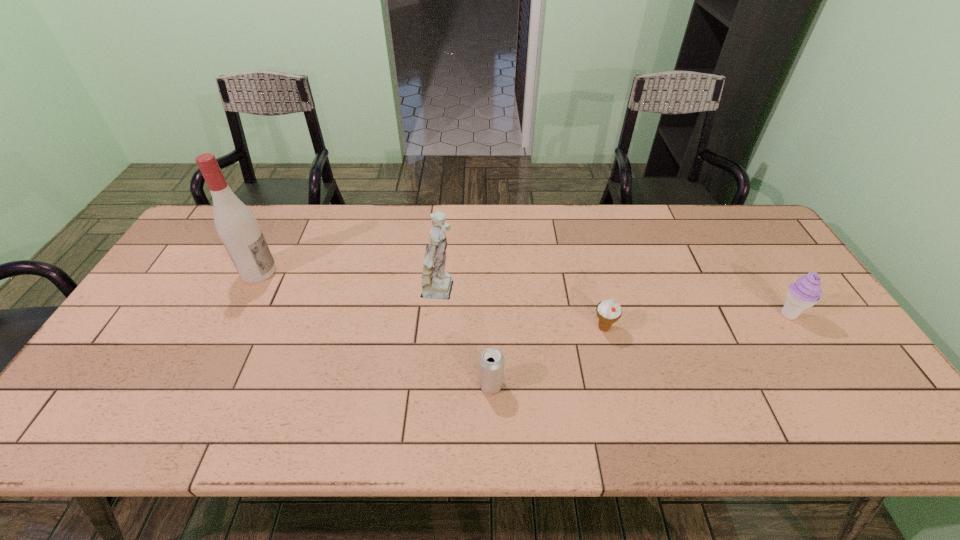
The width and height of the screenshot is (960, 540). What are the coordinates of `empty space between the leftmost object and the left icecream` in the screenshot? It's located at (431, 300).

The image size is (960, 540). I want to click on unoccupied position between the second object from left to right and the leftmost object, so click(350, 282).

Where is `free space between the fourth shortest object and the left icecream`? free space between the fourth shortest object and the left icecream is located at coordinates (523, 310).

Find the location of a particular element. The height and width of the screenshot is (540, 960). vacant space that is in between the fourth shortest object and the tallest object is located at coordinates (350, 282).

Locate an element on the screen. free space that is in between the nearest object and the third shortest object is located at coordinates (639, 349).

The height and width of the screenshot is (540, 960). I want to click on free space between the left icecream and the third shortest object, so click(x=696, y=321).

Where is `free spot between the third object from right to left and the taller icecream`? The width and height of the screenshot is (960, 540). free spot between the third object from right to left and the taller icecream is located at coordinates (639, 349).

The width and height of the screenshot is (960, 540). In order to click on blank region between the figurine and the left icecream in this screenshot , I will do `click(523, 310)`.

Locate an element on the screen. This screenshot has height=540, width=960. vacant space in between the second object from right to left and the alcohol is located at coordinates (431, 300).

Find the location of a particular element. This screenshot has width=960, height=540. the second closest object to the third object from left to right is located at coordinates (608, 311).